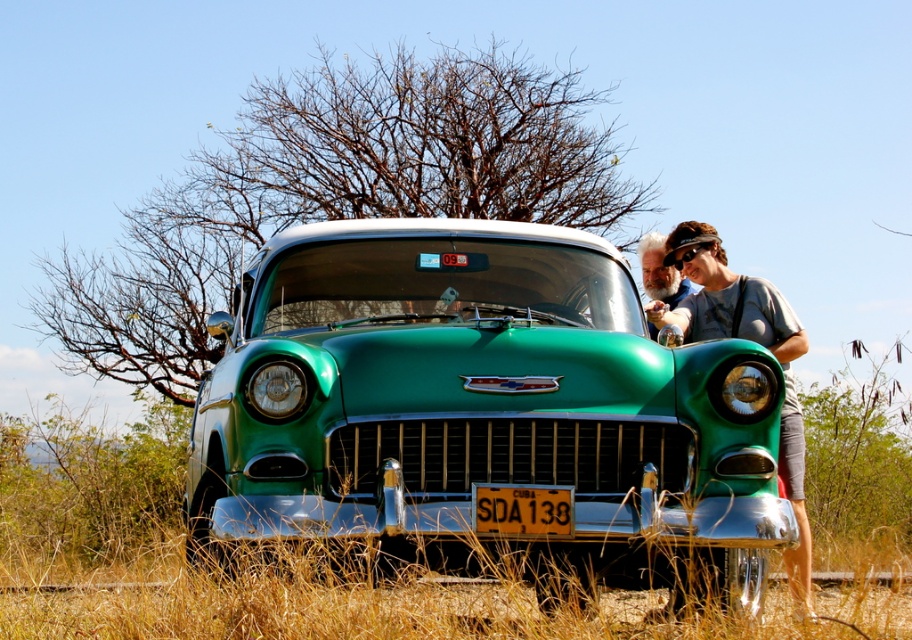
Is yellow plastic license plate at center thinner than bearded man at center?

No.

Locate an element on the screen. This screenshot has height=640, width=912. yellow plastic license plate at center is located at coordinates (522, 509).

Which is in front, point (307, 321) or point (556, 516)?

Positioned in front is point (556, 516).

Is green shiny car at center to the right of yellow plastic license plate at center from the viewer's perspective?

In fact, green shiny car at center is to the left of yellow plastic license plate at center.

Is point (262, 417) less distant than point (539, 502)?

No, it is not.

Where is `green shiny car at center`? green shiny car at center is located at coordinates (482, 410).

Is point (548, 506) in front of point (680, 268)?

Yes.

Can you confirm if yellow plastic license plate at center is shorter than black rubber sunglasses at upper center?

In fact, yellow plastic license plate at center may be taller than black rubber sunglasses at upper center.

Locate an element on the screen. The width and height of the screenshot is (912, 640). yellow plastic license plate at center is located at coordinates (522, 509).

Locate an element on the screen. This screenshot has width=912, height=640. yellow plastic license plate at center is located at coordinates (522, 509).